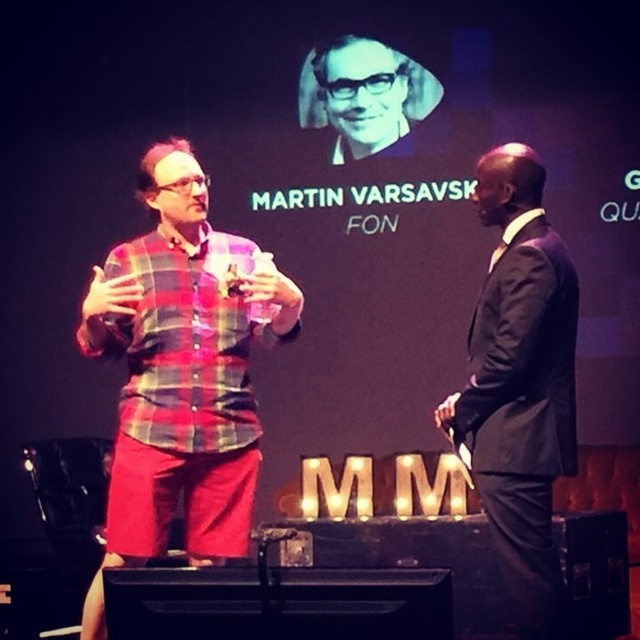
Question: Is black satin suit at right above matte black glasses at upper center?

Choices:
 (A) yes
 (B) no

Answer: (B)

Question: Estimate the real-world distances between objects in this image. Which object is closer to the matte black glasses at upper center?

Choices:
 (A) black satin suit at right
 (B) plaid fabric shirt at left

Answer: (B)

Question: Is the position of black satin suit at right more distant than that of matte black glasses at upper center?

Choices:
 (A) yes
 (B) no

Answer: (B)

Question: Can you confirm if black satin suit at right is thinner than matte black glasses at upper center?

Choices:
 (A) no
 (B) yes

Answer: (B)

Question: Which point appears closest to the camera in this image?

Choices:
 (A) pos(397,74)
 (B) pos(563,260)

Answer: (B)

Question: Which point is farther to the camera?

Choices:
 (A) matte black glasses at upper center
 (B) black satin suit at right
 (C) plaid fabric shirt at left

Answer: (A)